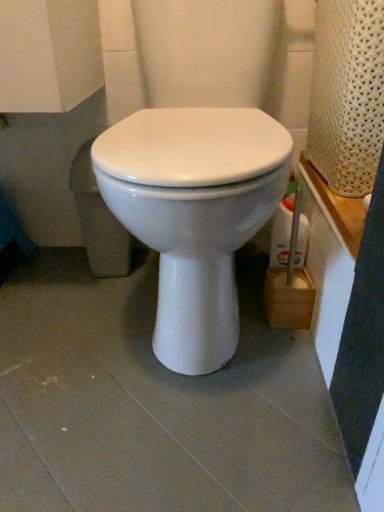
The width and height of the screenshot is (384, 512). In order to click on free point above white smooth concrete at center (from a real-world perspective) in this screenshot , I will do `click(140, 355)`.